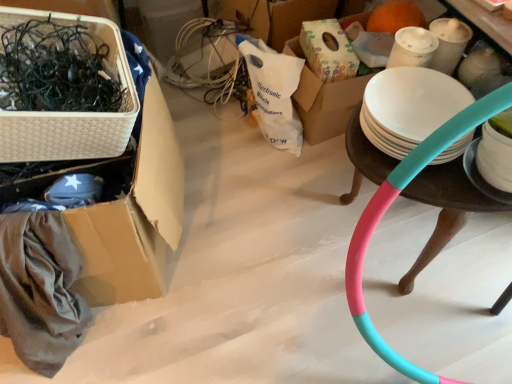
Question: Considering the relative positions of white matte plate at right and white wicker basket at upper left in the image provided, is white matte plate at right to the left or to the right of white wicker basket at upper left?

Choices:
 (A) right
 (B) left

Answer: (A)

Question: Does point (490, 187) appear closer or farther from the camera than point (96, 153)?

Choices:
 (A) farther
 (B) closer

Answer: (B)

Question: Based on their relative distances, which object is nearer to the teal matte hula hoop at right?

Choices:
 (A) white wicker basket at left
 (B) white matte plate at right
 (C) white wicker basket at upper left

Answer: (B)

Question: Which object is the farthest from the white matte plate at right?

Choices:
 (A) teal matte hula hoop at right
 (B) white wicker basket at left
 (C) white wicker basket at upper left

Answer: (C)